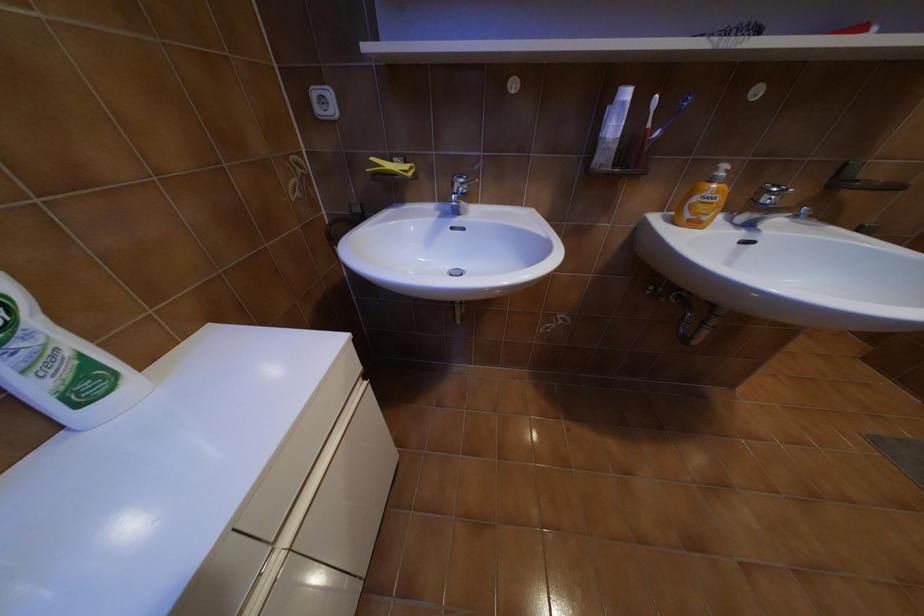
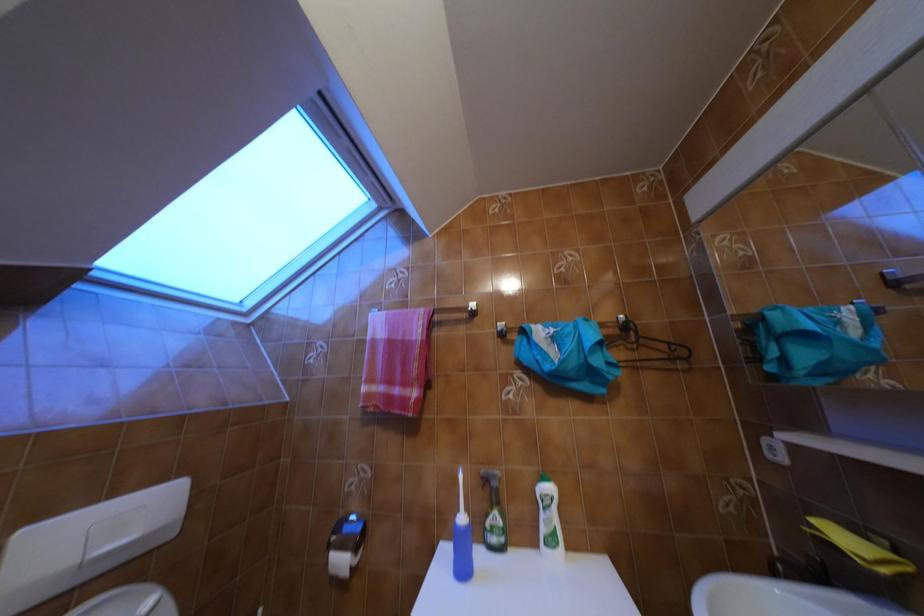
Question: Based on the continuous images, in which direction is the camera rotating? Reply with the corresponding letter.

Choices:
 (A) Left
 (B) Right
 (C) Up
 (D) Down

Answer: (A)